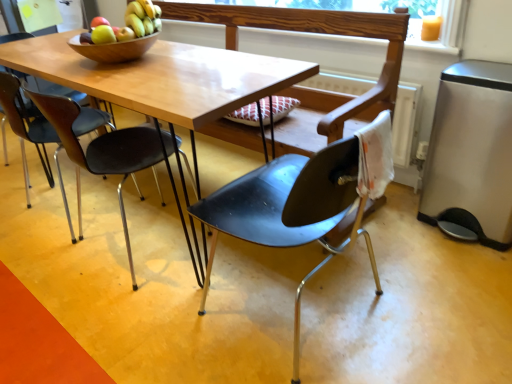
You are a GUI agent. You are given a task and a screenshot of the screen. Output one action in this format:
    pyautogui.click(x=<x>, y=<y>)
    Task: Click on the wooden frame at upper center
    The height and width of the screenshot is (384, 512).
    Given the screenshot: What is the action you would take?
    pyautogui.click(x=441, y=25)

What do you see at coordinates (103, 148) in the screenshot? I see `black plastic chair at left, the 2th chair viewed from the left` at bounding box center [103, 148].

Describe the element at coordinates (289, 209) in the screenshot. I see `matte black chair at center, acting as the 1th chair starting from the right` at that location.

What is the approximate width of matte black chair at center, which is the 3th chair in left-to-right order?

matte black chair at center, which is the 3th chair in left-to-right order, is 50.03 centimeters wide.

Locate an element on the screen. The image size is (512, 384). matte black chair at left, the 1th chair when ordered from left to right is located at coordinates (29, 131).

Identify the location of stainless steel trash can at right. (472, 152).

I want to click on wooden frame at upper center, so click(441, 25).

Can you tell me how much black plastic chair at left, the 2th chair viewed from the left, and stainless steel trash can at right differ in facing direction?

The facing directions of black plastic chair at left, the 2th chair viewed from the left, and stainless steel trash can at right are 176 degrees apart.

Who is more distant, black plastic chair at left, which appears as the second chair when viewed from the right, or stainless steel trash can at right?

stainless steel trash can at right is more distant.

Considering the relative sizes of black plastic chair at left, which appears as the second chair when viewed from the right, and stainless steel trash can at right in the image provided, is black plastic chair at left, which appears as the second chair when viewed from the right, shorter than stainless steel trash can at right?

Incorrect, the height of black plastic chair at left, which appears as the second chair when viewed from the right, does not fall short of that of stainless steel trash can at right.

Could you measure the distance between black plastic chair at left, which appears as the second chair when viewed from the right, and stainless steel trash can at right?

black plastic chair at left, which appears as the second chair when viewed from the right, is 1.19 meters from stainless steel trash can at right.

From a real-world perspective, which is physically below, matte black chair at left, acting as the 3th chair starting from the right, or wooden frame at upper center?

In real-world perspective, matte black chair at left, acting as the 3th chair starting from the right, is lower.

In terms of width, does matte black chair at left, acting as the 3th chair starting from the right, look wider or thinner when compared to wooden frame at upper center?

Considering their sizes, matte black chair at left, acting as the 3th chair starting from the right, looks broader than wooden frame at upper center.

Can you tell me how much matte black chair at left, the 1th chair when ordered from left to right, and wooden frame at upper center differ in facing direction?

There is a 180-degree angle between the facing directions of matte black chair at left, the 1th chair when ordered from left to right, and wooden frame at upper center.

Considering the relative sizes of matte black chair at left, acting as the 3th chair starting from the right, and wooden frame at upper center in the image provided, is matte black chair at left, acting as the 3th chair starting from the right, smaller than wooden frame at upper center?

No.

Is black plastic chair at left, the 2th chair viewed from the left, next to wooden frame at upper center and touching it?

No, black plastic chair at left, the 2th chair viewed from the left, is not in contact with wooden frame at upper center.

Looking at this image, who is taller, black plastic chair at left, which appears as the second chair when viewed from the right, or wooden frame at upper center?

black plastic chair at left, which appears as the second chair when viewed from the right.

This screenshot has height=384, width=512. I want to click on the 2nd chair to the left when counting from the wooden frame at upper center, so click(x=103, y=148).

From the image's perspective, is black plastic chair at left, which appears as the second chair when viewed from the right, below wooden frame at upper center?

Indeed, from the image's perspective, black plastic chair at left, which appears as the second chair when viewed from the right, is shown beneath wooden frame at upper center.

How many degrees apart are the facing directions of wooden frame at upper center and stainless steel trash can at right?

3.6 degrees separate the facing orientations of wooden frame at upper center and stainless steel trash can at right.

Which is more distant, (431, 2) or (472, 162)?

Positioned behind is point (431, 2).

Which of these two, wooden frame at upper center or stainless steel trash can at right, stands taller?

stainless steel trash can at right.

Is wooden frame at upper center far away from stainless steel trash can at right?

Actually, wooden frame at upper center and stainless steel trash can at right are a little close together.

From the picture: Is wooden frame at upper center at the right side of matte black chair at left, acting as the 3th chair starting from the right?

Yes, wooden frame at upper center is to the right of matte black chair at left, acting as the 3th chair starting from the right.

Is wooden frame at upper center with matte black chair at left, acting as the 3th chair starting from the right?

wooden frame at upper center and matte black chair at left, acting as the 3th chair starting from the right, are clearly separated.

Considering the positions of objects wooden frame at upper center and matte black chair at left, the 1th chair when ordered from left to right, in the image provided, who is in front, wooden frame at upper center or matte black chair at left, the 1th chair when ordered from left to right,?

Positioned in front is matte black chair at left, the 1th chair when ordered from left to right.

Find the location of a particular element. This screenshot has height=384, width=512. window screen behind the matte black chair at left, acting as the 3th chair starting from the right is located at coordinates (441, 25).

Between wooden frame at upper center and black plastic chair at left, the 2th chair viewed from the left, which one appears on the left side from the viewer's perspective?

black plastic chair at left, the 2th chair viewed from the left.

Is the depth of wooden frame at upper center less than that of black plastic chair at left, the 2th chair viewed from the left?

No, it is behind black plastic chair at left, the 2th chair viewed from the left.

Considering the sizes of objects wooden frame at upper center and black plastic chair at left, which appears as the second chair when viewed from the right, in the image provided, who is wider, wooden frame at upper center or black plastic chair at left, which appears as the second chair when viewed from the right,?

black plastic chair at left, which appears as the second chair when viewed from the right.

From a real-world perspective, is wooden frame at upper center on top of black plastic chair at left, which appears as the second chair when viewed from the right?

Correct, in the physical world, wooden frame at upper center is higher than black plastic chair at left, which appears as the second chair when viewed from the right.

Between stainless steel trash can at right and matte black chair at left, acting as the 3th chair starting from the right, which one has less height?

With less height is stainless steel trash can at right.

From a real-world perspective, which object rests below the other?

stainless steel trash can at right, from a real-world perspective.

Between stainless steel trash can at right and matte black chair at left, acting as the 3th chair starting from the right, which one appears on the right side from the viewer's perspective?

stainless steel trash can at right.

Where is `chair that is the 1st one above the stainless steel trash can at right (from a real-world perspective)`? chair that is the 1st one above the stainless steel trash can at right (from a real-world perspective) is located at coordinates (103, 148).

Find the location of a particular element. This screenshot has height=384, width=512. chair that is the 1st object directly below the wooden frame at upper center (from a real-world perspective) is located at coordinates (29, 131).

Considering their positions, is stainless steel trash can at right positioned closer to wooden frame at upper center than matte black chair at left, acting as the 3th chair starting from the right?

The object closer to wooden frame at upper center is stainless steel trash can at right.

Based on their spatial positions, is black plastic chair at left, the 2th chair viewed from the left, or stainless steel trash can at right closer to matte black chair at center, which is the 3th chair in left-to-right order?

The object closer to matte black chair at center, which is the 3th chair in left-to-right order, is black plastic chair at left, the 2th chair viewed from the left.

Based on their spatial positions, is matte black chair at center, acting as the 1th chair starting from the right, or black plastic chair at left, the 2th chair viewed from the left, closer to wooden frame at upper center?

matte black chair at center, acting as the 1th chair starting from the right.

From the image, which object appears to be farther from matte black chair at left, acting as the 3th chair starting from the right, wooden frame at upper center or black plastic chair at left, the 2th chair viewed from the left?

wooden frame at upper center.

Based on their spatial positions, is black plastic chair at left, the 2th chair viewed from the left, or wooden frame at upper center closer to matte black chair at center, acting as the 1th chair starting from the right?

The object closer to matte black chair at center, acting as the 1th chair starting from the right, is black plastic chair at left, the 2th chair viewed from the left.

Looking at the image, which one is located closer to matte black chair at center, which is the 3th chair in left-to-right order, matte black chair at left, acting as the 3th chair starting from the right, or black plastic chair at left, which appears as the second chair when viewed from the right?

black plastic chair at left, which appears as the second chair when viewed from the right, lies closer to matte black chair at center, which is the 3th chair in left-to-right order, than the other object.

When comparing their distances from stainless steel trash can at right, does matte black chair at left, the 1th chair when ordered from left to right, or wooden frame at upper center seem further?

matte black chair at left, the 1th chair when ordered from left to right, is positioned further to the anchor stainless steel trash can at right.

Which object lies nearer to the anchor point stainless steel trash can at right, black plastic chair at left, the 2th chair viewed from the left, or matte black chair at left, acting as the 3th chair starting from the right?

black plastic chair at left, the 2th chair viewed from the left.

Find the location of `window screen between matte black chair at left, acting as the 3th chair starting from the right, and stainless steel trash can at right`. window screen between matte black chair at left, acting as the 3th chair starting from the right, and stainless steel trash can at right is located at coordinates (441, 25).

Locate an element on the screen. The height and width of the screenshot is (384, 512). chair between matte black chair at left, the 1th chair when ordered from left to right, and matte black chair at center, acting as the 1th chair starting from the right is located at coordinates (103, 148).

Find the location of a particular element. appliance between wooden frame at upper center and matte black chair at center, acting as the 1th chair starting from the right, in the vertical direction is located at coordinates (472, 152).

Locate an element on the screen. window screen between black plastic chair at left, the 2th chair viewed from the left, and stainless steel trash can at right from left to right is located at coordinates (441, 25).